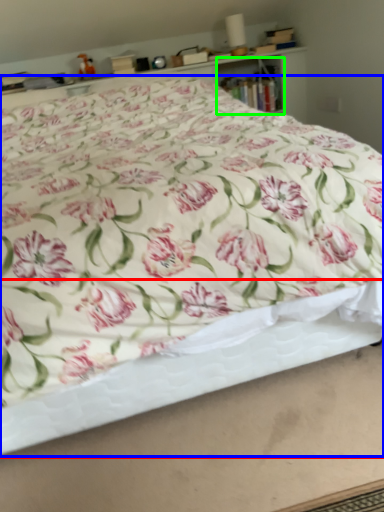
Question: Considering the real-world distances, which object is farthest from bed frame (highlighted by a red box)? bed (highlighted by a blue box) or cabinet (highlighted by a green box)?

Choices:
 (A) bed
 (B) cabinet

Answer: (B)